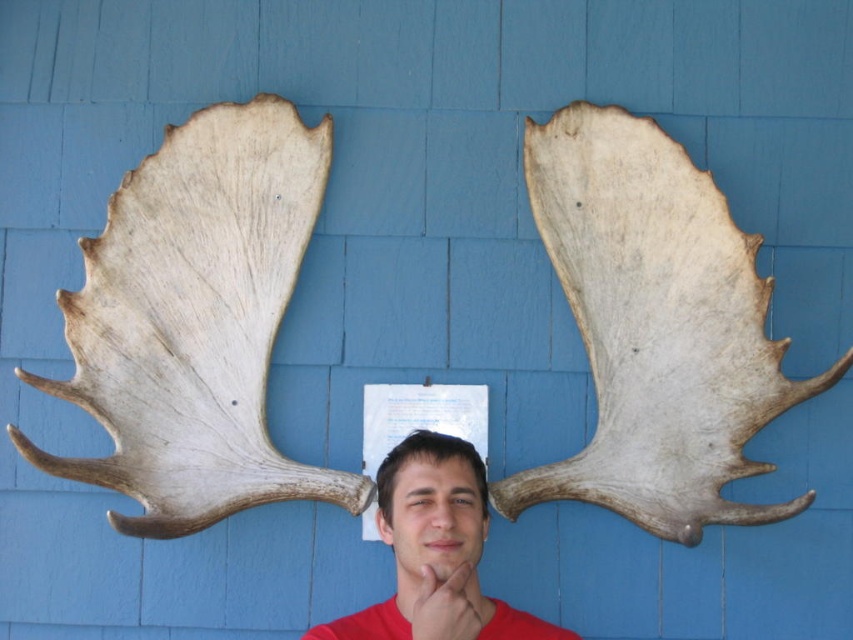
Question: Estimate the real-world distances between objects in this image. Which object is closer to the matte skin at center?

Choices:
 (A) matte brown hair at center
 (B) matte red shirt at center

Answer: (B)

Question: Based on their relative distances, which object is nearer to the matte brown hair at center?

Choices:
 (A) matte skin at center
 (B) matte red shirt at center

Answer: (B)

Question: Does matte red shirt at center lie in front of matte skin at center?

Choices:
 (A) no
 (B) yes

Answer: (B)

Question: Which object appears farthest from the camera in this image?

Choices:
 (A) matte skin at center
 (B) matte brown hair at center
 (C) matte red shirt at center

Answer: (B)

Question: Is matte red shirt at center to the right of matte skin at center from the viewer's perspective?

Choices:
 (A) yes
 (B) no

Answer: (B)

Question: From the image, what is the correct spatial relationship of matte red shirt at center in relation to matte skin at center?

Choices:
 (A) left
 (B) right

Answer: (A)